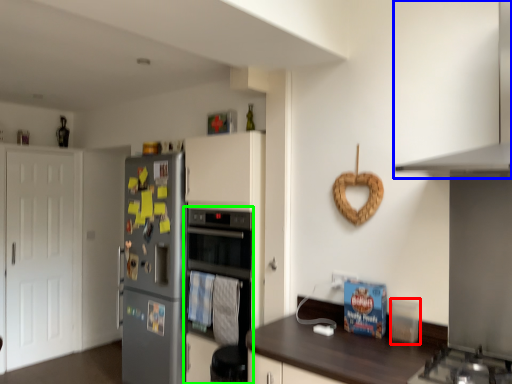
Question: Based on their relative distances, which object is nearer to appliance (highlighted by a red box)? Choose from exhaust hood (highlighted by a blue box) and oven (highlighted by a green box).

Choices:
 (A) exhaust hood
 (B) oven

Answer: (A)